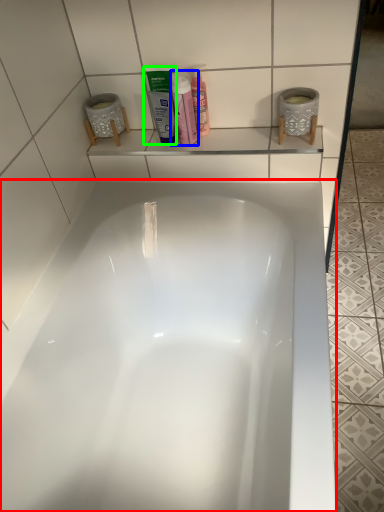
Question: Which object is positioned farthest from bathtub (highlighted by a red box)? Select from cleaning product (highlighted by a blue box) and mouthwash (highlighted by a green box).

Choices:
 (A) cleaning product
 (B) mouthwash

Answer: (A)